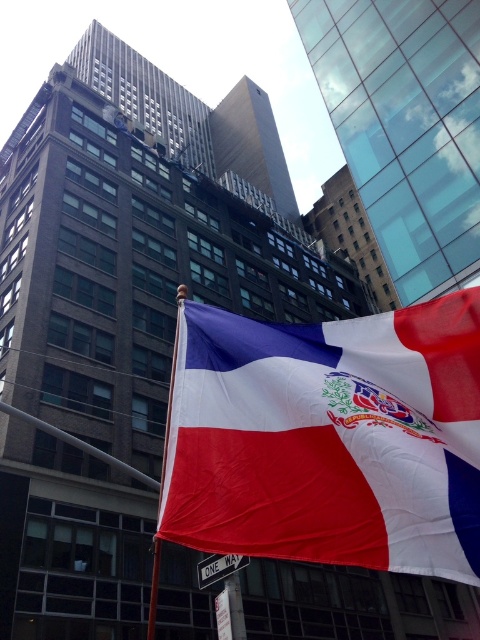
Question: Is textured fabric flag at center wider than metallic flag pole at center?

Choices:
 (A) no
 (B) yes

Answer: (A)

Question: Which point is closer to the camera?

Choices:
 (A) metallic flag pole at center
 (B) textured fabric flag at center

Answer: (B)

Question: Which point appears farthest from the camera in this image?

Choices:
 (A) (152, 582)
 (B) (360, 429)

Answer: (A)

Question: From the image, what is the correct spatial relationship of textured fabric flag at center in relation to metallic flag pole at center?

Choices:
 (A) below
 (B) above

Answer: (B)

Question: Is textured fabric flag at center positioned at the back of metallic flag pole at center?

Choices:
 (A) yes
 (B) no

Answer: (B)